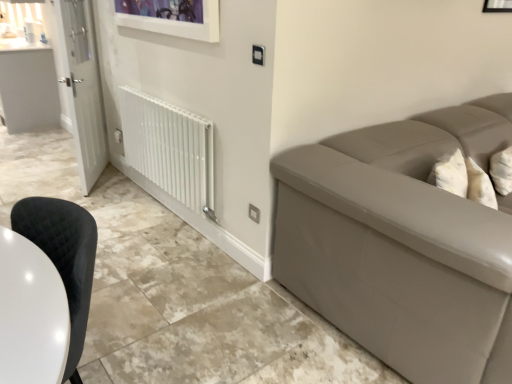
Question: Does white glossy door at left have a lesser height compared to white glossy radiator at lower left?

Choices:
 (A) no
 (B) yes

Answer: (A)

Question: Is white glossy door at left completely or partially outside of white glossy radiator at lower left?

Choices:
 (A) yes
 (B) no

Answer: (A)

Question: From the image's perspective, is white glossy door at left located above white glossy radiator at lower left?

Choices:
 (A) yes
 (B) no

Answer: (A)

Question: Is white glossy door at left wider than white glossy radiator at lower left?

Choices:
 (A) yes
 (B) no

Answer: (A)

Question: From the image's perspective, is white glossy door at left beneath white glossy radiator at lower left?

Choices:
 (A) no
 (B) yes

Answer: (A)

Question: From a real-world perspective, is white glossy counter top at upper left physically located above or below white glossy radiator at lower left?

Choices:
 (A) above
 (B) below

Answer: (B)

Question: Considering their positions, is white glossy counter top at upper left located in front of or behind white glossy radiator at lower left?

Choices:
 (A) behind
 (B) front

Answer: (A)

Question: From the image's perspective, is white glossy counter top at upper left above or below white glossy radiator at lower left?

Choices:
 (A) below
 (B) above

Answer: (B)

Question: In terms of height, does white glossy counter top at upper left look taller or shorter compared to white glossy radiator at lower left?

Choices:
 (A) tall
 (B) short

Answer: (A)

Question: Relative to white glossy counter top at upper left, is white glossy radiator at lower left in front or behind?

Choices:
 (A) behind
 (B) front

Answer: (B)

Question: Is white glossy radiator at lower left wider or thinner than white glossy counter top at upper left?

Choices:
 (A) wide
 (B) thin

Answer: (B)

Question: Does point (133, 91) appear closer or farther from the camera than point (19, 99)?

Choices:
 (A) farther
 (B) closer

Answer: (B)

Question: From the image's perspective, relative to white glossy counter top at upper left, is white glossy radiator at lower left above or below?

Choices:
 (A) above
 (B) below

Answer: (B)

Question: Considering the positions of black quilted fabric chair at lower left and white glossy counter top at upper left in the image, is black quilted fabric chair at lower left bigger or smaller than white glossy counter top at upper left?

Choices:
 (A) small
 (B) big

Answer: (A)

Question: Is black quilted fabric chair at lower left in front of or behind white glossy counter top at upper left in the image?

Choices:
 (A) behind
 (B) front

Answer: (B)